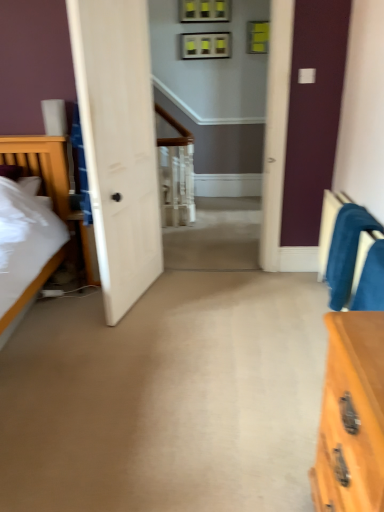
Question: Is point (362, 284) closer or farther from the camera than point (334, 248)?

Choices:
 (A) closer
 (B) farther

Answer: (A)

Question: In the image, is velvet blue armchair at right, the 1th armchair viewed from the front, positioned in front of or behind velvet blue armchair at right, which ranks as the 1th armchair in back-to-front order?

Choices:
 (A) behind
 (B) front

Answer: (B)

Question: Looking at their shapes, would you say velvet blue armchair at right, arranged as the 2th armchair when viewed from the back, is wider or thinner than velvet blue armchair at right, the second armchair in the front-to-back sequence?

Choices:
 (A) thin
 (B) wide

Answer: (B)

Question: In terms of size, does velvet blue armchair at right, the second armchair in the front-to-back sequence, appear bigger or smaller than velvet blue armchair at right, the 1th armchair viewed from the front?

Choices:
 (A) small
 (B) big

Answer: (B)

Question: Is velvet blue armchair at right, which ranks as the 1th armchair in back-to-front order, spatially inside velvet blue armchair at right, arranged as the 2th armchair when viewed from the back, or outside of it?

Choices:
 (A) inside
 (B) outside

Answer: (B)

Question: In the image, is velvet blue armchair at right, the second armchair in the front-to-back sequence, positioned in front of or behind velvet blue armchair at right, the 1th armchair viewed from the front?

Choices:
 (A) front
 (B) behind

Answer: (B)

Question: From a real-world perspective, is velvet blue armchair at right, which ranks as the 1th armchair in back-to-front order, physically located above or below velvet blue armchair at right, arranged as the 2th armchair when viewed from the back?

Choices:
 (A) above
 (B) below

Answer: (B)